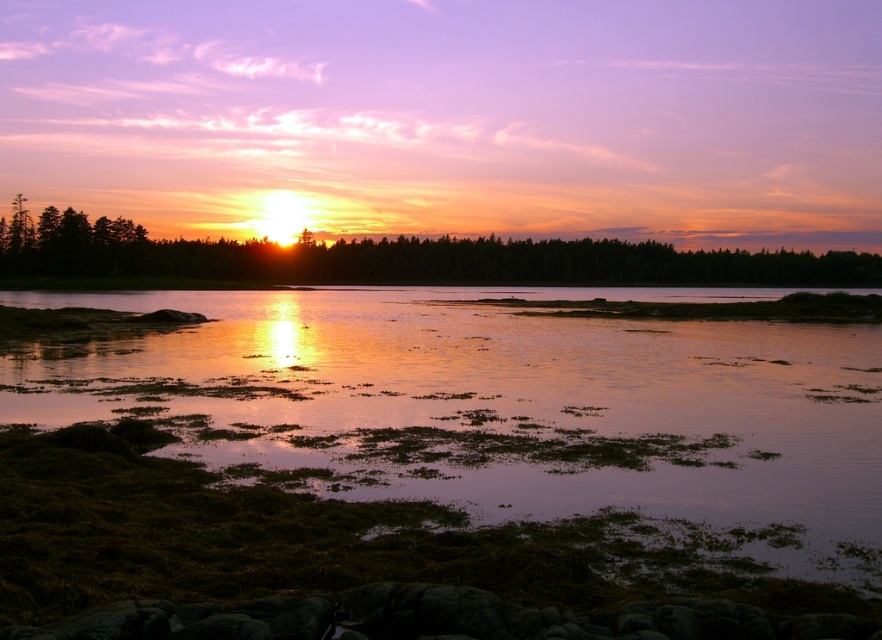
You are a photographer trying to capture the sunset reflection on the water. You notice the green algae at lower center and the green leafy trees at center. Which object is closer to the water surface?

The green algae at lower center is positioned under green leafy trees at center, so it is closer to the water surface.

You are standing on the lakeshore and see the point marked at coordinates (501, 410). What is located at that point?

The green algae at lower center is located at point (501, 410).

Consider the image. You are standing on the lakeside and want to compare the height of the green algae at lower center and the green leafy trees at center. Which one is taller?

The green algae at lower center has a lesser height compared to the green leafy trees at center, so the green leafy trees at center are taller.